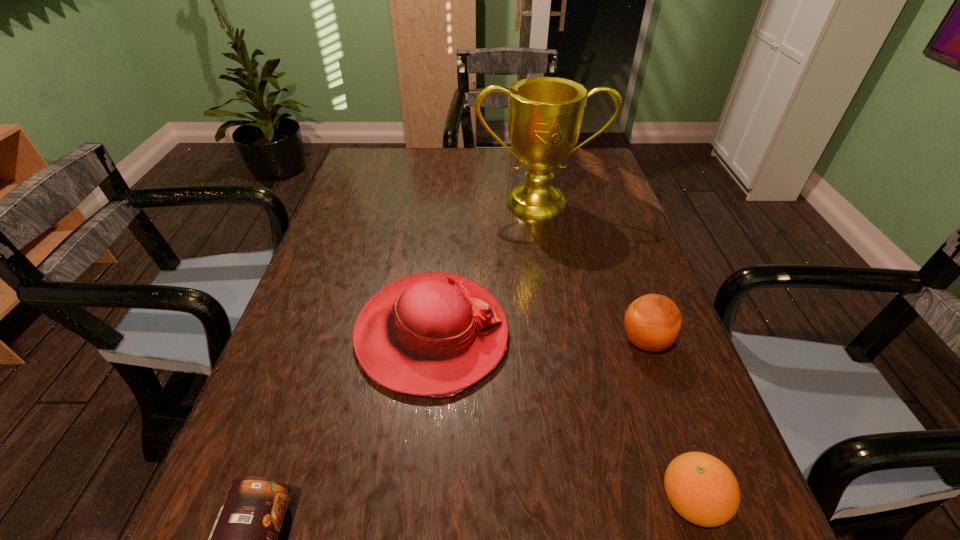
Find the location of a particular element. vacant space in between the nearer orange and the farther orange is located at coordinates (668, 421).

Identify the location of vacant space that is in between the farther orange and the shorter orange. The height and width of the screenshot is (540, 960). (668, 421).

What are the coordinates of `free spot between the hat and the tallest object` in the screenshot? It's located at (485, 269).

Where is `unoccupied area between the shorter orange and the hat`? The width and height of the screenshot is (960, 540). unoccupied area between the shorter orange and the hat is located at coordinates (562, 418).

What are the coordinates of `free spot between the nearer orange and the tallest object` in the screenshot? It's located at (614, 352).

This screenshot has height=540, width=960. Find the location of `the second closest object to the taller orange`. the second closest object to the taller orange is located at coordinates (433, 334).

Locate an element on the screen. The height and width of the screenshot is (540, 960). object that ranks as the third closest to the can is located at coordinates (652, 322).

The height and width of the screenshot is (540, 960). Find the location of `free space that satisfies the following two spatial constraints: 1. on the shiny surface of the shorter orange; 2. on the right side of the tallest object`. free space that satisfies the following two spatial constraints: 1. on the shiny surface of the shorter orange; 2. on the right side of the tallest object is located at coordinates (590, 501).

Find the location of a particular element. Image resolution: width=960 pixels, height=540 pixels. vacant region that satisfies the following two spatial constraints: 1. at the front of the hat with a bow; 2. on the left side of the shorter orange is located at coordinates [x=415, y=501].

Locate an element on the screen. vacant space that satisfies the following two spatial constraints: 1. on the back side of the nearer orange; 2. at the front of the hat with a bow is located at coordinates (636, 334).